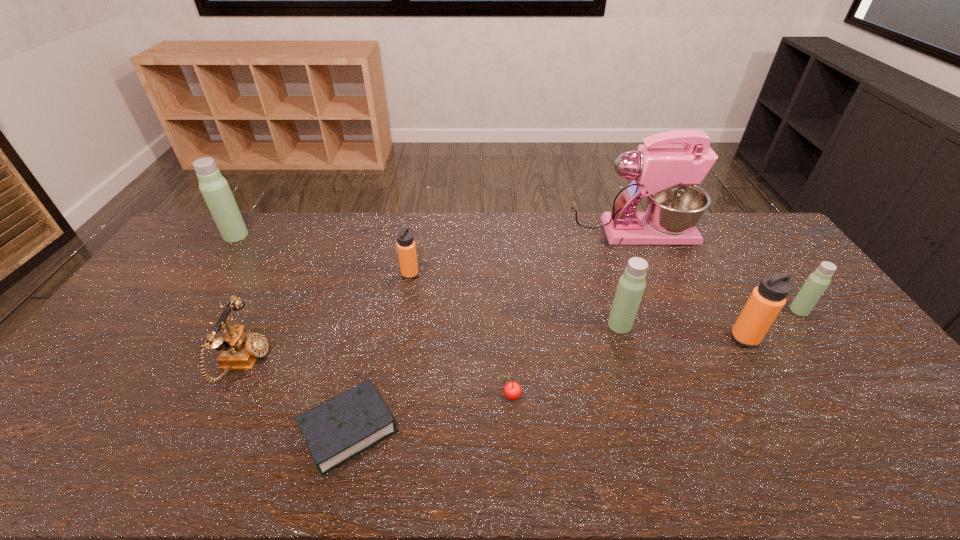
Locate an element on the screen. The image size is (960, 540). object positioned at the far left corner is located at coordinates 214,188.

The image size is (960, 540). What are the coordinates of `vacant region at the far edge` in the screenshot? It's located at [x=300, y=228].

At what (x,y) coordinates should I click in order to perform the action: click on vacant space at the near edge. Please return your answer as a coordinate pair (x, y). This screenshot has width=960, height=540. Looking at the image, I should click on (675, 471).

This screenshot has height=540, width=960. I want to click on free space at the left edge of the desktop, so click(x=90, y=397).

In the image, there is a desktop. Identify the location of vacant space at the right edge. The width and height of the screenshot is (960, 540). (765, 261).

You are a GUI agent. You are given a task and a screenshot of the screen. Output one action in this format:
    pyautogui.click(x=<x>, y=<y>)
    Task: Click on the vacant point at the far left corner
    This screenshot has height=540, width=960.
    Given the screenshot: What is the action you would take?
    pyautogui.click(x=185, y=249)

In the image, there is a desktop. Where is `free space at the far right corner`? This screenshot has width=960, height=540. free space at the far right corner is located at coordinates (735, 234).

Where is `unoccupied area between the second light thermos bottle from left to right and the leftmost object`? The height and width of the screenshot is (540, 960). unoccupied area between the second light thermos bottle from left to right and the leftmost object is located at coordinates (427, 280).

I want to click on free space between the third farthest object and the eighth object from right to left, so click(x=327, y=319).

At what (x,y) coordinates should I click in order to perform the action: click on vacant space in between the rightmost object and the shortest object. Please return your answer as a coordinate pair (x, y). The image size is (960, 540). Looking at the image, I should click on (574, 370).